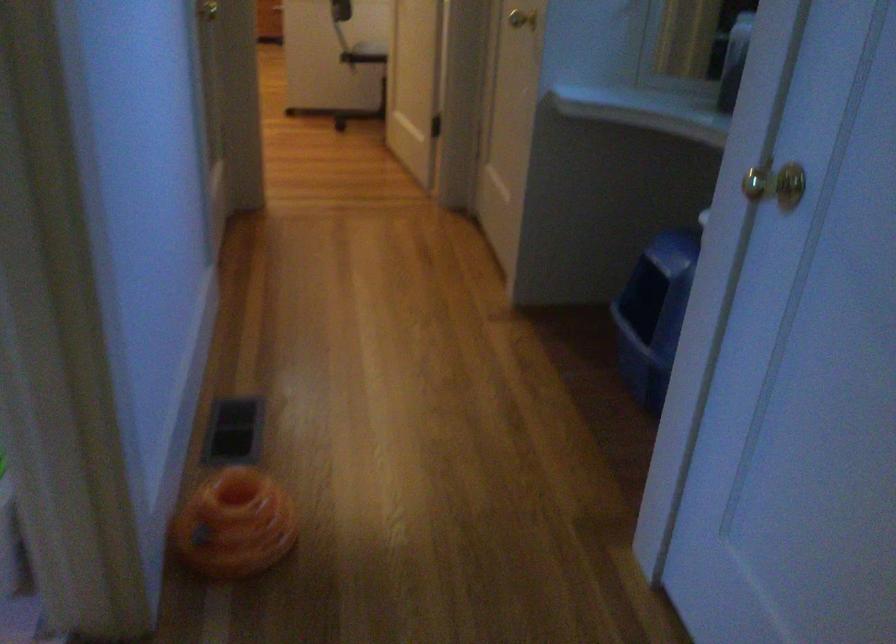
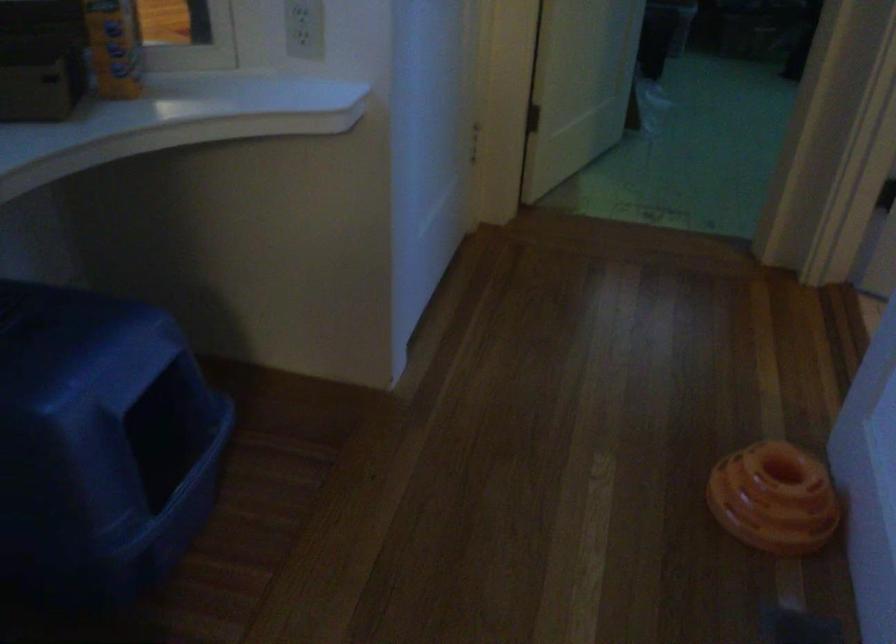
Find the pixel in the second image that matches pixel 673 239 in the first image.

(99, 442)